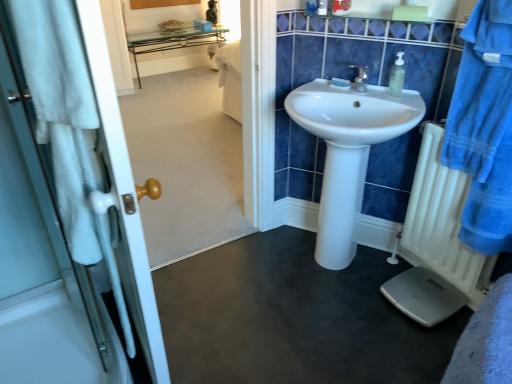
Question: Can you confirm if smooth white scale at center is shorter than blue cotton bathrobe at right?

Choices:
 (A) yes
 (B) no

Answer: (A)

Question: Is smooth white scale at center to the left of blue cotton bathrobe at right from the viewer's perspective?

Choices:
 (A) yes
 (B) no

Answer: (A)

Question: Does smooth white scale at center come in front of blue cotton bathrobe at right?

Choices:
 (A) no
 (B) yes

Answer: (A)

Question: Does smooth white scale at center lie behind blue cotton bathrobe at right?

Choices:
 (A) no
 (B) yes

Answer: (B)

Question: Does smooth white scale at center have a greater width compared to blue cotton bathrobe at right?

Choices:
 (A) no
 (B) yes

Answer: (B)

Question: In terms of size, does white glossy door handle at left appear bigger or smaller than smooth white scale at center?

Choices:
 (A) big
 (B) small

Answer: (B)

Question: In the image, is white glossy door handle at left positioned in front of or behind smooth white scale at center?

Choices:
 (A) front
 (B) behind

Answer: (A)

Question: Choose the correct answer: Is white glossy door handle at left inside smooth white scale at center or outside it?

Choices:
 (A) outside
 (B) inside

Answer: (A)

Question: Is white glossy door handle at left taller or shorter than smooth white scale at center?

Choices:
 (A) short
 (B) tall

Answer: (B)

Question: Based on their sizes in the image, would you say white glossy sink at center is bigger or smaller than blue cotton bathrobe at right?

Choices:
 (A) small
 (B) big

Answer: (B)

Question: From a real-world perspective, is white glossy sink at center positioned above or below blue cotton bathrobe at right?

Choices:
 (A) above
 (B) below

Answer: (B)

Question: Visually, is white glossy sink at center positioned to the left or to the right of blue cotton bathrobe at right?

Choices:
 (A) right
 (B) left

Answer: (B)

Question: Relative to blue cotton bathrobe at right, is white glossy sink at center in front or behind?

Choices:
 (A) front
 (B) behind

Answer: (B)

Question: Relative to white plastic radiator at right, is white glossy door handle at left in front or behind?

Choices:
 (A) front
 (B) behind

Answer: (A)

Question: Is white glossy door handle at left situated inside white plastic radiator at right or outside?

Choices:
 (A) outside
 (B) inside

Answer: (A)